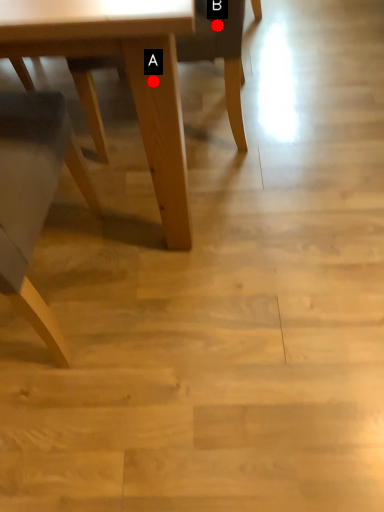
Question: Two points are circled on the image, labeled by A and B beside each circle. Which point is farther to the camera?

Choices:
 (A) A is further
 (B) B is further

Answer: (B)